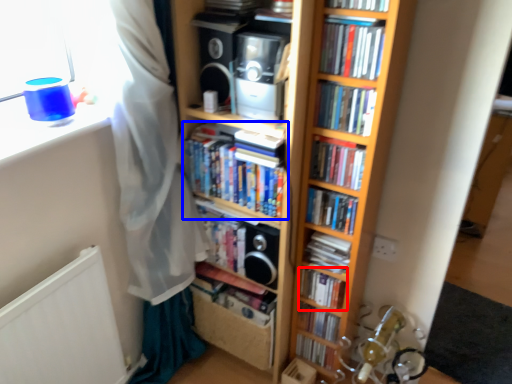
Question: Which of the following is the closest to the observer, book (highlighted by a red box) or book (highlighted by a blue box)?

Choices:
 (A) book
 (B) book

Answer: (B)